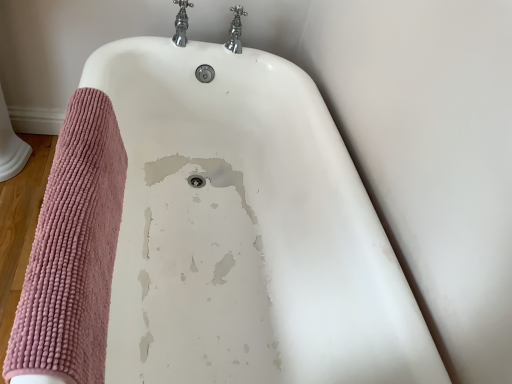
Question: Is chrome metallic faucet at upper center, acting as the first tap starting from the right, directly adjacent to white glossy bathtub at center?

Choices:
 (A) no
 (B) yes

Answer: (A)

Question: Considering the relative positions of chrome metallic faucet at upper center, the second tap when ordered from left to right, and white glossy bathtub at center in the image provided, is chrome metallic faucet at upper center, the second tap when ordered from left to right, to the left of white glossy bathtub at center from the viewer's perspective?

Choices:
 (A) no
 (B) yes

Answer: (A)

Question: Can you confirm if chrome metallic faucet at upper center, the second tap when ordered from left to right, is wider than white glossy bathtub at center?

Choices:
 (A) yes
 (B) no

Answer: (B)

Question: Is the position of chrome metallic faucet at upper center, acting as the first tap starting from the right, less distant than that of white glossy bathtub at center?

Choices:
 (A) yes
 (B) no

Answer: (B)

Question: Is chrome metallic faucet at upper center, the second tap when ordered from left to right, facing away from white glossy bathtub at center?

Choices:
 (A) yes
 (B) no

Answer: (B)

Question: Considering their positions, is white glossy bathtub at center located in front of or behind chrome metallic faucet at upper center, acting as the first tap starting from the right?

Choices:
 (A) front
 (B) behind

Answer: (A)

Question: From a real-world perspective, is white glossy bathtub at center positioned above or below chrome metallic faucet at upper center, acting as the first tap starting from the right?

Choices:
 (A) above
 (B) below

Answer: (B)

Question: Considering the positions of point (231, 57) and point (234, 51), is point (231, 57) closer or farther from the camera than point (234, 51)?

Choices:
 (A) farther
 (B) closer

Answer: (A)

Question: Considering the positions of white glossy bathtub at center and chrome metallic faucet at upper center, acting as the first tap starting from the right, in the image, is white glossy bathtub at center taller or shorter than chrome metallic faucet at upper center, acting as the first tap starting from the right,?

Choices:
 (A) short
 (B) tall

Answer: (B)

Question: Is chrome metallic faucet at upper center, the second tap when ordered from left to right, taller or shorter than white glossy bathtub at center?

Choices:
 (A) tall
 (B) short

Answer: (B)

Question: Is chrome metallic faucet at upper center, acting as the first tap starting from the right, spatially inside white glossy bathtub at center, or outside of it?

Choices:
 (A) inside
 (B) outside

Answer: (B)

Question: Looking at their shapes, would you say chrome metallic faucet at upper center, acting as the first tap starting from the right, is wider or thinner than white glossy bathtub at center?

Choices:
 (A) thin
 (B) wide

Answer: (A)

Question: In the image, is chrome metallic faucet at upper center, the second tap when ordered from left to right, on the left side or the right side of white glossy bathtub at center?

Choices:
 (A) right
 (B) left

Answer: (A)

Question: From a real-world perspective, is chrome metallic faucet at upper center, which is the second tap in right-to-left order, positioned above or below chrome metallic faucet at upper center, the second tap when ordered from left to right?

Choices:
 (A) above
 (B) below

Answer: (B)

Question: From their relative heights in the image, would you say chrome metallic faucet at upper center, which is the second tap in right-to-left order, is taller or shorter than chrome metallic faucet at upper center, the second tap when ordered from left to right?

Choices:
 (A) short
 (B) tall

Answer: (A)